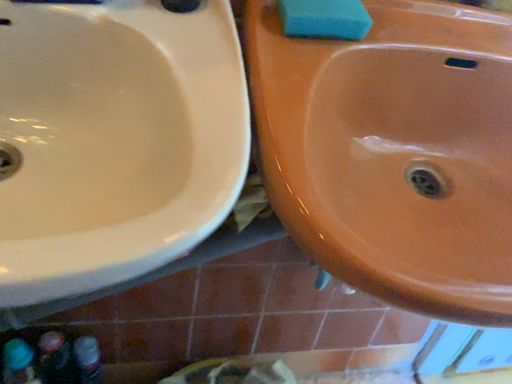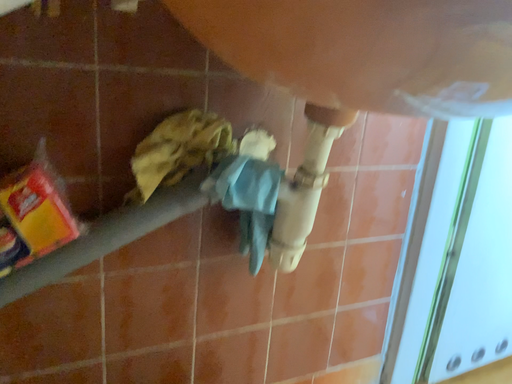
Question: How did the camera likely rotate when shooting the video?

Choices:
 (A) rotated downward
 (B) rotated upward

Answer: (B)